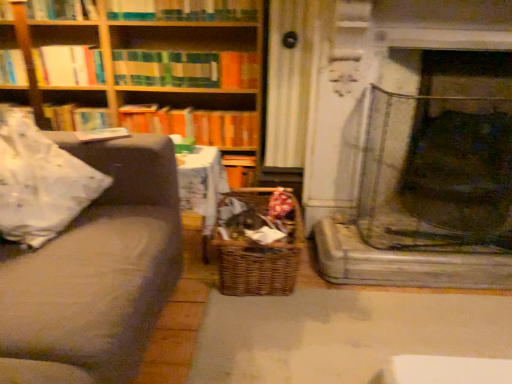
Where is `wooden bookshelf at upper left`? This screenshot has height=384, width=512. wooden bookshelf at upper left is located at coordinates (68, 65).

This screenshot has height=384, width=512. What do you see at coordinates (40, 183) in the screenshot? I see `white fabric pillow at left` at bounding box center [40, 183].

This screenshot has height=384, width=512. In order to click on woven brown basket at center in this screenshot , I will do `click(260, 266)`.

The width and height of the screenshot is (512, 384). Find the location of `hardcover book at upper left, positioned as the 2th book in bottom-to-top order`. hardcover book at upper left, positioned as the 2th book in bottom-to-top order is located at coordinates (75, 118).

What is the approximate width of orange matte book at center, acting as the 1th book starting from the bottom?

9.73 inches.

The image size is (512, 384). Describe the element at coordinates (182, 10) in the screenshot. I see `hardcover book at upper center, which is counted as the fourth book, starting from the bottom` at that location.

Measure the distance between point (86, 3) and camera.

7.28 feet.

The width and height of the screenshot is (512, 384). What do you see at coordinates (186, 69) in the screenshot? I see `striped fabric book at upper center, the third book when ordered from top to bottom` at bounding box center [186, 69].

Where is `wooden bookshelf at upper left`? The image size is (512, 384). wooden bookshelf at upper left is located at coordinates click(x=68, y=65).

From the picture: Is striped fabric book at upper center, arranged as the 3th book when ordered from the bottom, smaller than orange matte book at center, the 5th book in the top-to-bottom sequence?

Indeed, striped fabric book at upper center, arranged as the 3th book when ordered from the bottom, has a smaller size compared to orange matte book at center, the 5th book in the top-to-bottom sequence.

From the image's perspective, between striped fabric book at upper center, the third book when ordered from top to bottom, and orange matte book at center, the 5th book in the top-to-bottom sequence, who is located below?

orange matte book at center, the 5th book in the top-to-bottom sequence, is shown below in the image.

How different are the orientations of striped fabric book at upper center, arranged as the 3th book when ordered from the bottom, and orange matte book at center, acting as the 1th book starting from the bottom, in degrees?

The facing directions of striped fabric book at upper center, arranged as the 3th book when ordered from the bottom, and orange matte book at center, acting as the 1th book starting from the bottom, are 0.000179 degrees apart.

Is striped fabric book at upper center, the third book when ordered from top to bottom, in front of or behind hardcover book at upper left, positioned as the fourth book in top-to-bottom order, in the image?

striped fabric book at upper center, the third book when ordered from top to bottom, is positioned closer to the viewer than hardcover book at upper left, positioned as the fourth book in top-to-bottom order.

From the image's perspective, between striped fabric book at upper center, the third book when ordered from top to bottom, and hardcover book at upper left, positioned as the 2th book in bottom-to-top order, who is located below?

hardcover book at upper left, positioned as the 2th book in bottom-to-top order, appears lower in the image.

Which of these two, striped fabric book at upper center, arranged as the 3th book when ordered from the bottom, or hardcover book at upper left, positioned as the 2th book in bottom-to-top order, stands shorter?

Standing shorter between the two is striped fabric book at upper center, arranged as the 3th book when ordered from the bottom.

From the picture: Considering the positions of objects striped fabric book at upper center, arranged as the 3th book when ordered from the bottom, and hardcover book at upper left, positioned as the 2th book in bottom-to-top order, in the image provided, who is more to the left, striped fabric book at upper center, arranged as the 3th book when ordered from the bottom, or hardcover book at upper left, positioned as the 2th book in bottom-to-top order,?

hardcover book at upper left, positioned as the 2th book in bottom-to-top order.

In terms of width, does white fabric pillow at left look wider or thinner when compared to woodenmaterial/texturebookcase at upper left?

Clearly, white fabric pillow at left has more width compared to woodenmaterial/texturebookcase at upper left.

Does white fabric pillow at left come behind woodenmaterial/texturebookcase at upper left?

No, white fabric pillow at left is in front of woodenmaterial/texturebookcase at upper left.

Do you think white fabric pillow at left is within woodenmaterial/texturebookcase at upper left, or outside of it?

white fabric pillow at left cannot be found inside woodenmaterial/texturebookcase at upper left.

From their relative heights in the image, would you say white fabric pillow at left is taller or shorter than woodenmaterial/texturebookcase at upper left?

Clearly, white fabric pillow at left is shorter compared to woodenmaterial/texturebookcase at upper left.

From the picture: How distant is wooden bookshelf at upper left from woven brown basket at center?

They are 4.48 feet apart.

Is wooden bookshelf at upper left further to the viewer compared to woven brown basket at center?

Yes, wooden bookshelf at upper left is further from the camera.

From the image's perspective, is wooden bookshelf at upper left on top of woven brown basket at center?

Correct, wooden bookshelf at upper left appears higher than woven brown basket at center in the image.

Is wooden bookshelf at upper left thinner than woven brown basket at center?

Yes.

Is hardcover book at upper center, which is counted as the fourth book, starting from the bottom, thinner than woodenmaterial/texturebookcase at upper left?

Yes.

Is hardcover book at upper center, the second book in the top-to-bottom sequence, facing away from woodenmaterial/texturebookcase at upper left?

Yes, hardcover book at upper center, the second book in the top-to-bottom sequence, is facing away from woodenmaterial/texturebookcase at upper left.

Consider the image. Considering the relative positions of hardcover book at upper center, which is counted as the fourth book, starting from the bottom, and woodenmaterial/texturebookcase at upper left in the image provided, is hardcover book at upper center, which is counted as the fourth book, starting from the bottom, to the right of woodenmaterial/texturebookcase at upper left from the viewer's perspective?

Yes.

From the image's perspective, which one is positioned lower, hardcover book at upper center, the second book in the top-to-bottom sequence, or woodenmaterial/texturebookcase at upper left?

woodenmaterial/texturebookcase at upper left appears lower in the image.

Looking at this image, is woodenmaterial/texturebookcase at upper left facing towards orange matte book at center, the 5th book in the top-to-bottom sequence?

Yes, woodenmaterial/texturebookcase at upper left is facing orange matte book at center, the 5th book in the top-to-bottom sequence.

Is woodenmaterial/texturebookcase at upper left placed right next to orange matte book at center, the 5th book in the top-to-bottom sequence?

They are not placed beside each other.

Is woodenmaterial/texturebookcase at upper left to the right of orange matte book at center, the 5th book in the top-to-bottom sequence, from the viewer's perspective?

No.

Is woodenmaterial/texturebookcase at upper left taller or shorter than orange matte book at center, acting as the 1th book starting from the bottom?

Clearly, woodenmaterial/texturebookcase at upper left is taller compared to orange matte book at center, acting as the 1th book starting from the bottom.

Looking at this image, is wooden bookshelf at upper left shorter than hardcover book at upper left, acting as the 5th book starting from the bottom?

In fact, wooden bookshelf at upper left may be taller than hardcover book at upper left, acting as the 5th book starting from the bottom.

Considering the relative sizes of wooden bookshelf at upper left and hardcover book at upper left, marked as the first book in a top-to-bottom arrangement, in the image provided, is wooden bookshelf at upper left thinner than hardcover book at upper left, marked as the first book in a top-to-bottom arrangement,?

No.

In the image, is wooden bookshelf at upper left on the left side or the right side of hardcover book at upper left, marked as the first book in a top-to-bottom arrangement?

Clearly, wooden bookshelf at upper left is on the left of hardcover book at upper left, marked as the first book in a top-to-bottom arrangement, in the image.

From a real-world perspective, between wooden bookshelf at upper left and hardcover book at upper left, acting as the 5th book starting from the bottom, who is vertically higher?

hardcover book at upper left, acting as the 5th book starting from the bottom.

From the image's perspective, starting from the striped fabric book at upper center, arranged as the 3th book when ordered from the bottom, which book is the 2nd one below? Please provide its 2D coordinates.

[(194, 124)]

Locate an element on the screen. book that is the 2nd object located behind the striped fabric book at upper center, the third book when ordered from top to bottom is located at coordinates (75, 118).

Based on their spatial positions, is orange matte book at center, the 5th book in the top-to-bottom sequence, or hardcover book at upper left, marked as the first book in a top-to-bottom arrangement, further from hardcover book at upper left, positioned as the 2th book in bottom-to-top order?

hardcover book at upper left, marked as the first book in a top-to-bottom arrangement, is positioned further to the anchor hardcover book at upper left, positioned as the 2th book in bottom-to-top order.

Looking at the image, which one is located further to hardcover book at upper center, the second book in the top-to-bottom sequence, woven brown basket at center or striped fabric book at upper center, arranged as the 3th book when ordered from the bottom?

woven brown basket at center lies further to hardcover book at upper center, the second book in the top-to-bottom sequence, than the other object.

From the image, which object appears to be farther from woodenmaterial/texturebookcase at upper left, striped fabric book at upper center, arranged as the 3th book when ordered from the bottom, or hardcover book at upper left, positioned as the fourth book in top-to-bottom order?

hardcover book at upper left, positioned as the fourth book in top-to-bottom order, is further to woodenmaterial/texturebookcase at upper left.

When comparing their distances from wooden bookshelf at upper left, does woven brown basket at center or hardcover book at upper center, the second book in the top-to-bottom sequence, seem further?

woven brown basket at center is further to wooden bookshelf at upper left.

In the scene shown: When comparing their distances from hardcover book at upper left, marked as the first book in a top-to-bottom arrangement, does white fabric pillow at left or orange matte book at center, acting as the 1th book starting from the bottom, seem closer?

orange matte book at center, acting as the 1th book starting from the bottom, lies closer to hardcover book at upper left, marked as the first book in a top-to-bottom arrangement, than the other object.

Considering their positions, is orange matte book at center, acting as the 1th book starting from the bottom, positioned closer to white fabric pillow at left than woodenmaterial/texturebookcase at upper left?

orange matte book at center, acting as the 1th book starting from the bottom, is positioned closer to the anchor white fabric pillow at left.

Based on their spatial positions, is woodenmaterial/texturebookcase at upper left or wooden bookshelf at upper left closer to hardcover book at upper left, positioned as the fourth book in top-to-bottom order?

wooden bookshelf at upper left is closer to hardcover book at upper left, positioned as the fourth book in top-to-bottom order.

Considering their positions, is hardcover book at upper center, which is counted as the fourth book, starting from the bottom, positioned closer to wooden bookshelf at upper left than white fabric pillow at left?

hardcover book at upper center, which is counted as the fourth book, starting from the bottom, is closer to wooden bookshelf at upper left.

Where is `bookcase between hardcover book at upper left, marked as the first book in a top-to-bottom arrangement, and striped fabric book at upper center, the third book when ordered from top to bottom, from left to right`? This screenshot has width=512, height=384. bookcase between hardcover book at upper left, marked as the first book in a top-to-bottom arrangement, and striped fabric book at upper center, the third book when ordered from top to bottom, from left to right is located at coordinates (156, 67).

Locate an element on the screen. Image resolution: width=512 pixels, height=384 pixels. bookcase between wooden bookshelf at upper left and orange matte book at center, the 5th book in the top-to-bottom sequence is located at coordinates (156, 67).

Where is `bookcase between hardcover book at upper center, which is counted as the fourth book, starting from the bottom, and woven brown basket at center in the up-down direction`? The image size is (512, 384). bookcase between hardcover book at upper center, which is counted as the fourth book, starting from the bottom, and woven brown basket at center in the up-down direction is located at coordinates (156, 67).

The image size is (512, 384). Find the location of `pillow that lies between hardcover book at upper center, which is counted as the fourth book, starting from the bottom, and woven brown basket at center from top to bottom`. pillow that lies between hardcover book at upper center, which is counted as the fourth book, starting from the bottom, and woven brown basket at center from top to bottom is located at coordinates (40, 183).